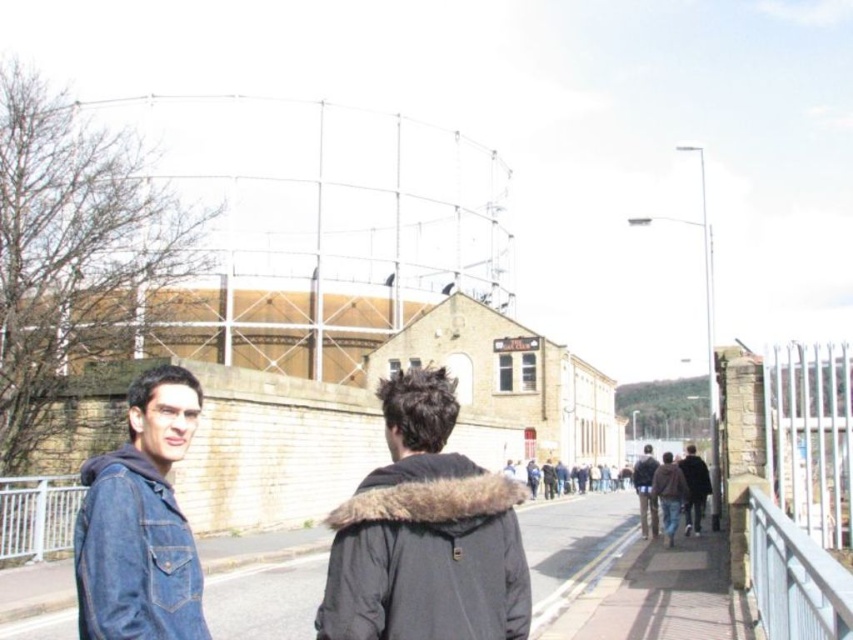
You are standing at the pathway and want to take a photo of the dark brown fur coat at right without the white metal fence at lower left blocking the view. Is it possible to do so by moving to the side?

The white metal fence at lower left is positioned over the dark brown fur coat at right, so moving to the side might allow you to position yourself where the fence is no longer blocking the view of the coat.

You are standing at the point marked by coordinates point (426, 556) in the image. Looking around, you see dark brown fur lined jacket at center. What object is located exactly at your current position?

The point (426, 556) marks the location of the dark brown fur lined jacket at center.